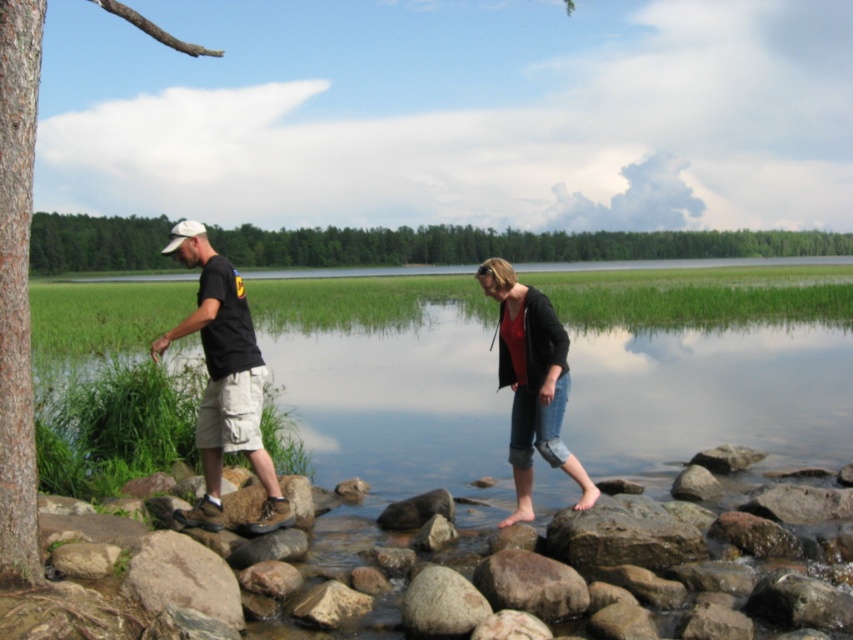
Question: Which point is farther to the camera?

Choices:
 (A) black cotton t-shirt at left
 (B) green leafy tree at upper center
 (C) smooth gray rock at lower center
 (D) denim jeans at center

Answer: (D)

Question: Does green leafy tree at upper center come behind smooth brown tree trunk at left?

Choices:
 (A) yes
 (B) no

Answer: (A)

Question: Is smooth brown tree trunk at left further to camera compared to black cotton t-shirt at left?

Choices:
 (A) no
 (B) yes

Answer: (A)

Question: Which point appears farthest from the camera in this image?

Choices:
 (A) [x=180, y=333]
 (B) [x=525, y=376]
 (C) [x=396, y=228]

Answer: (C)

Question: Can you confirm if green leafy tree at upper center is positioned to the left of smooth gray rock at lower center?

Choices:
 (A) yes
 (B) no

Answer: (B)

Question: Which object is positioned closest to the black cotton t-shirt at left?

Choices:
 (A) smooth gray rock at lower center
 (B) smooth brown tree trunk at left
 (C) denim jeans at center
 (D) green leafy tree at upper center

Answer: (A)